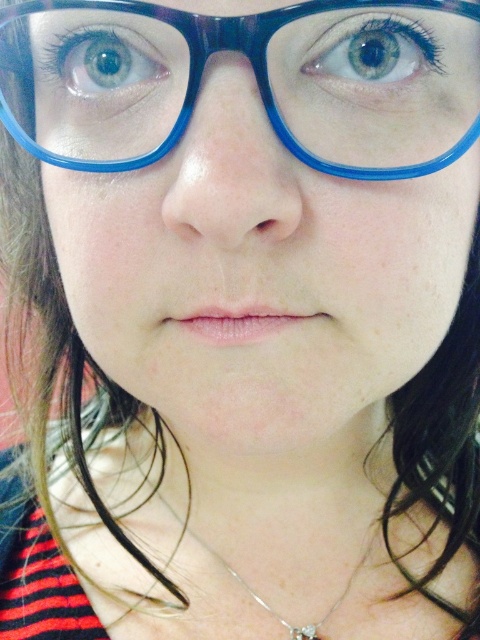
Who is positioned more to the left, blue glossy eye at upper center or silver metallic necklace at center?

silver metallic necklace at center

Which is behind, point (313, 52) or point (352, 580)?

The point (352, 580) is behind.

Is point (400, 33) more distant than point (372, 531)?

No, it is in front of (372, 531).

At what (x,y) coordinates should I click in order to perform the action: click on blue glossy eye at upper center. Please return your answer as a coordinate pair (x, y). Looking at the image, I should click on (372, 52).

Does blue glossy eye at upper left lie behind silver metallic necklace at center?

No.

Which of these two, blue glossy eye at upper left or silver metallic necklace at center, stands taller?

silver metallic necklace at center is taller.

Does point (97, 81) lie behind point (279, 620)?

That is False.

The width and height of the screenshot is (480, 640). I want to click on blue glossy eye at upper left, so click(x=97, y=61).

Is point (334, 125) positioned behind point (342, 65)?

No, it is in front of (342, 65).

Which is behind, point (146, 90) or point (429, 36)?

Positioned behind is point (146, 90).

Is point (332, 164) closer to camera compared to point (337, 48)?

Yes.

This screenshot has width=480, height=640. What are the coordinates of `blue plastic glasses at upper center` in the screenshot? It's located at click(x=254, y=76).